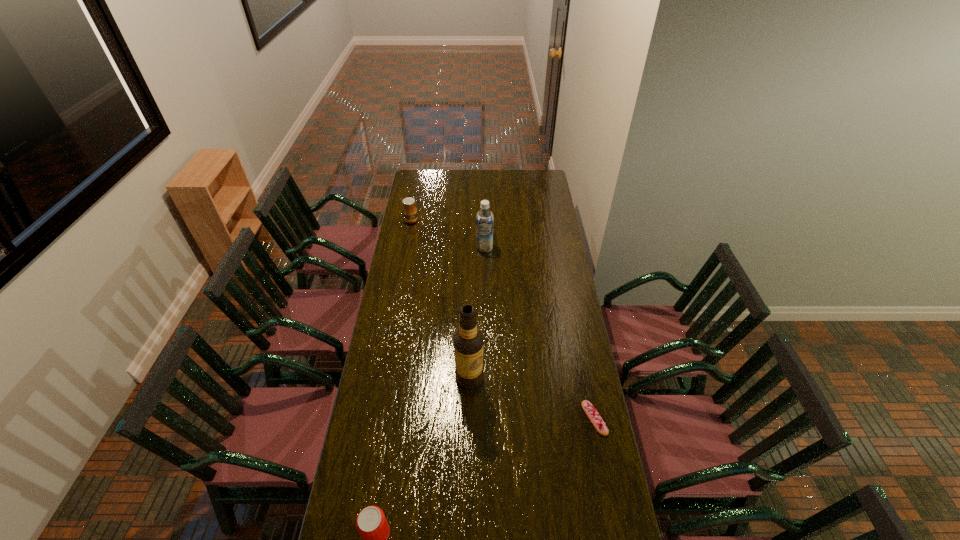
At what (x,y) coordinates should I click in order to perform the action: click on eclair. Please return your answer as a coordinate pair (x, y). The image size is (960, 540). Looking at the image, I should click on (591, 412).

The height and width of the screenshot is (540, 960). I want to click on the second nearest object, so click(591, 412).

At what (x,y) coordinates should I click in order to perform the action: click on alcohol. Please return your answer as a coordinate pair (x, y). The image size is (960, 540). Looking at the image, I should click on (468, 341).

Find the location of `the third nearest object`. the third nearest object is located at coordinates (468, 341).

The image size is (960, 540). In order to click on the farthest object in this screenshot , I will do `click(409, 210)`.

The height and width of the screenshot is (540, 960). I want to click on the second tallest object, so click(484, 219).

Find the location of `soya milk`. soya milk is located at coordinates (484, 219).

I want to click on vacant space located on the left of the eclair, so click(494, 418).

This screenshot has width=960, height=540. Find the location of `vacant space situated 0.230m on the label of the tallest object`. vacant space situated 0.230m on the label of the tallest object is located at coordinates (490, 442).

This screenshot has height=540, width=960. In order to click on vacant region located on the label of the tallest object in this screenshot , I will do `click(487, 433)`.